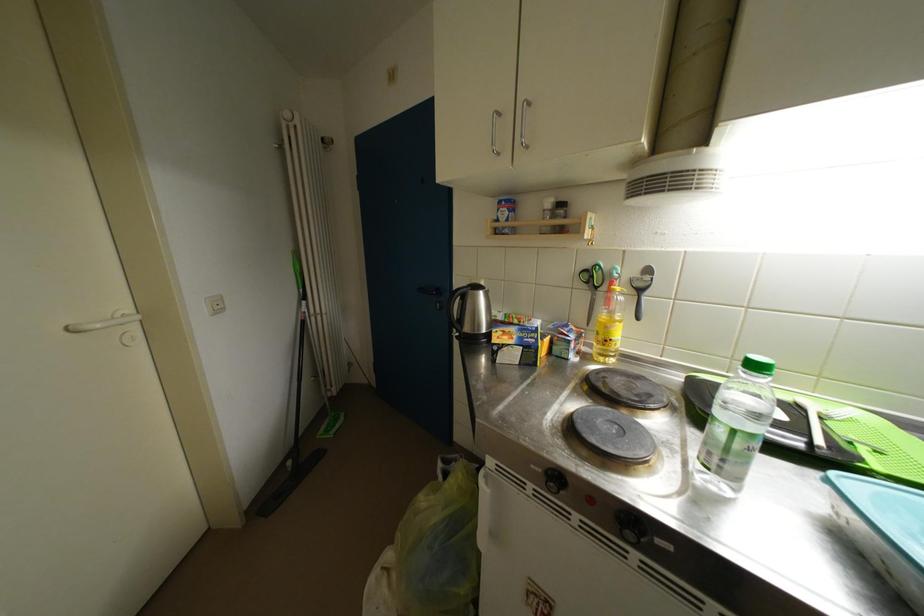
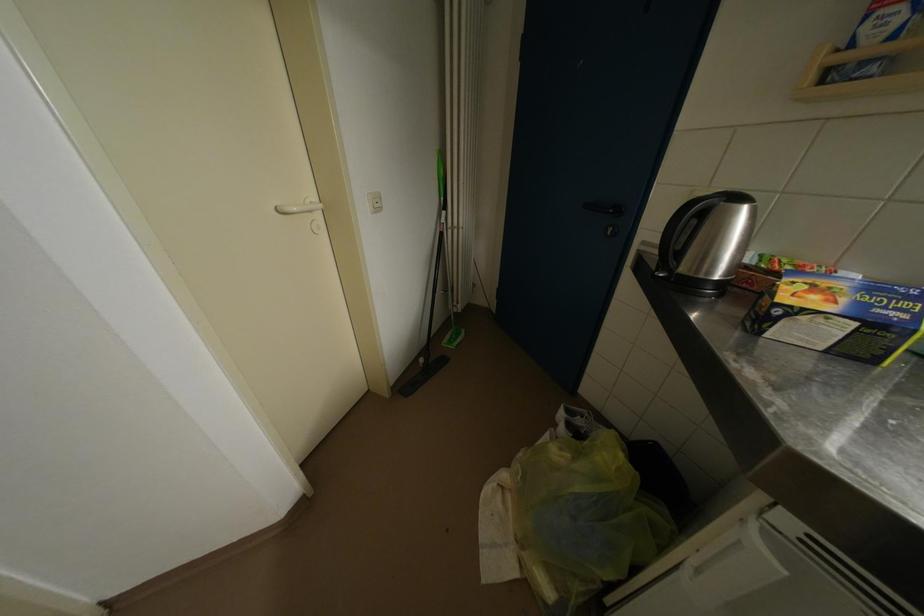
What movement of the cameraman would produce the second image?

The movement direction of the cameraman is left, forward.